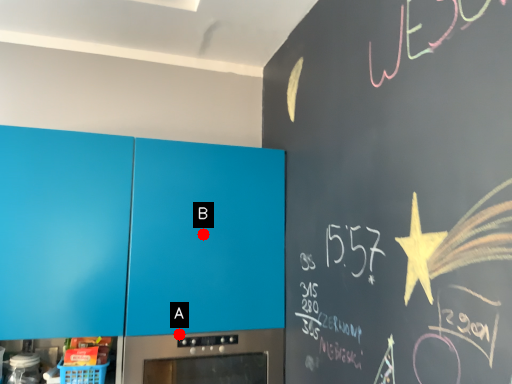
Question: Two points are circled on the image, labeled by A and B beside each circle. Which point appears closest to the camera in this image?

Choices:
 (A) A is closer
 (B) B is closer

Answer: (A)